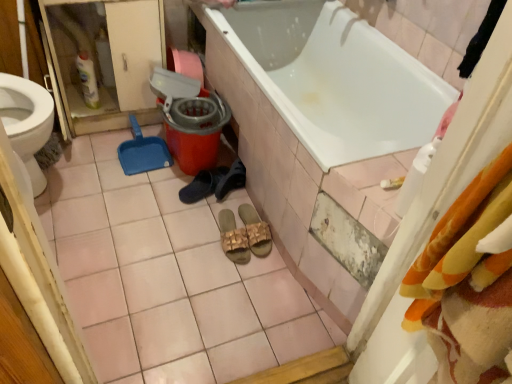
Question: Is black rubber slipper at center, which appears as the first footwear when viewed from the left, oriented away from beige woven sandals at center, acting as the 3th footwear starting from the left?

Choices:
 (A) yes
 (B) no

Answer: (B)

Question: From a real-world perspective, is black rubber slipper at center, acting as the 3th footwear starting from the right, physically below beige woven sandals at center, the 1th footwear in the right-to-left sequence?

Choices:
 (A) yes
 (B) no

Answer: (A)

Question: From a real-world perspective, is black rubber slipper at center, which appears as the first footwear when viewed from the left, located higher than beige woven sandals at center, the 1th footwear in the right-to-left sequence?

Choices:
 (A) no
 (B) yes

Answer: (A)

Question: Is black rubber slipper at center, which appears as the first footwear when viewed from the left, taller than beige woven sandals at center, acting as the 3th footwear starting from the left?

Choices:
 (A) yes
 (B) no

Answer: (B)

Question: Does black rubber slipper at center, which appears as the first footwear when viewed from the left, turn towards beige woven sandals at center, acting as the 3th footwear starting from the left?

Choices:
 (A) yes
 (B) no

Answer: (B)

Question: Considering the positions of orange plastic mop bucket at center and black suede shoes at center, positioned as the second footwear in right-to-left order, in the image, is orange plastic mop bucket at center wider or thinner than black suede shoes at center, positioned as the second footwear in right-to-left order,?

Choices:
 (A) wide
 (B) thin

Answer: (A)

Question: Is point (184, 155) positioned closer to the camera than point (224, 195)?

Choices:
 (A) closer
 (B) farther

Answer: (B)

Question: Do you think orange plastic mop bucket at center is within black suede shoes at center, which ranks as the second footwear in left-to-right order, or outside of it?

Choices:
 (A) inside
 (B) outside

Answer: (B)

Question: From a real-world perspective, is orange plastic mop bucket at center positioned above or below black suede shoes at center, which ranks as the second footwear in left-to-right order?

Choices:
 (A) below
 (B) above

Answer: (B)

Question: Is matte white screen door at left wider or thinner than white glossy bathtub at center?

Choices:
 (A) wide
 (B) thin

Answer: (B)

Question: Is point (108, 8) positioned closer to the camera than point (265, 49)?

Choices:
 (A) farther
 (B) closer

Answer: (B)

Question: From a real-world perspective, is matte white screen door at left above or below white glossy bathtub at center?

Choices:
 (A) above
 (B) below

Answer: (A)

Question: Is matte white screen door at left inside or outside of white glossy bathtub at center?

Choices:
 (A) outside
 (B) inside

Answer: (A)

Question: From a real-world perspective, is matte white screen door at left above or below black rubber slipper at center, acting as the 3th footwear starting from the right?

Choices:
 (A) above
 (B) below

Answer: (A)

Question: Is matte white screen door at left spatially inside black rubber slipper at center, acting as the 3th footwear starting from the right, or outside of it?

Choices:
 (A) outside
 (B) inside

Answer: (A)